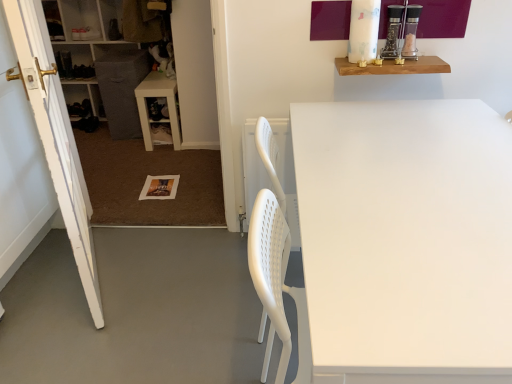
You are a GUI agent. You are given a task and a screenshot of the screen. Output one action in this format:
    pyautogui.click(x=<x>, y=<y>)
    Task: Click on the vacant space in front of white painted wood door at left
    
    Given the screenshot: What is the action you would take?
    pyautogui.click(x=79, y=334)